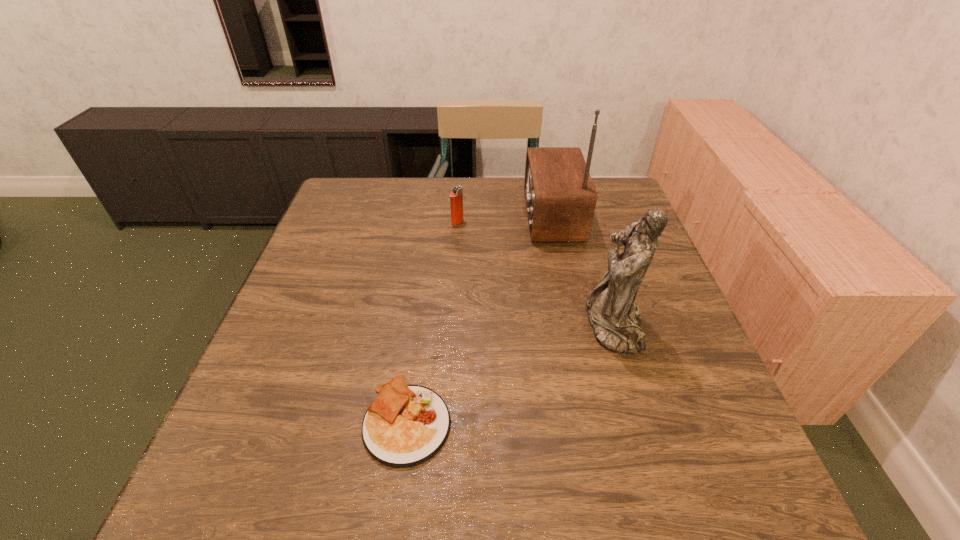
Find the location of a particular element. The image size is (960, 540). vacant space located on the front-facing side of the second nearest object is located at coordinates (560, 325).

Locate an element on the screen. vacant area located 0.110m on the right of the igniter is located at coordinates (503, 222).

You are a GUI agent. You are given a task and a screenshot of the screen. Output one action in this format:
    pyautogui.click(x=<x>, y=<y>)
    Task: Click on the vacant space located 0.230m on the left of the nearest object
    The height and width of the screenshot is (540, 960).
    Given the screenshot: What is the action you would take?
    pyautogui.click(x=233, y=421)

This screenshot has width=960, height=540. I want to click on radio receiver positioned at the far edge, so (560, 197).

The width and height of the screenshot is (960, 540). I want to click on igniter at the far edge, so click(x=456, y=196).

This screenshot has height=540, width=960. What are the coordinates of `object at the near edge` in the screenshot? It's located at (406, 425).

This screenshot has width=960, height=540. I want to click on radio receiver at the right edge, so click(x=560, y=197).

Locate an element on the screen. Image resolution: width=960 pixels, height=540 pixels. figurine that is positioned at the right edge is located at coordinates (615, 319).

Locate an element on the screen. The height and width of the screenshot is (540, 960). object at the far right corner is located at coordinates (560, 197).

Identify the location of vacant space at the far edge. (381, 214).